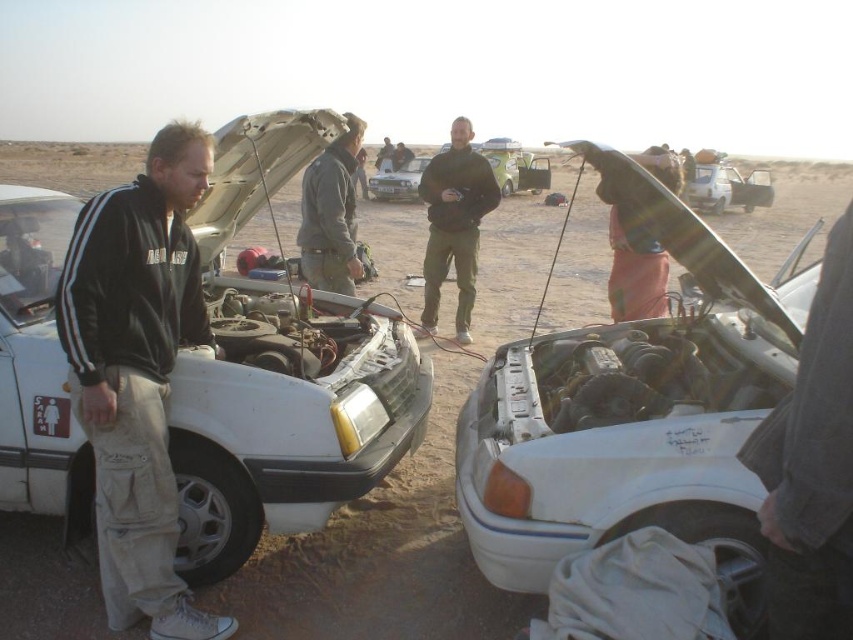
Image resolution: width=853 pixels, height=640 pixels. What do you see at coordinates (635, 412) in the screenshot?
I see `white matte car at center` at bounding box center [635, 412].

Locate an element on the screen. Image resolution: width=853 pixels, height=640 pixels. white matte car at center is located at coordinates (635, 412).

Is black matte jacket at center positioned in front of metallic silver car at center?

Yes, black matte jacket at center is in front of metallic silver car at center.

Between black matte jacket at center and metallic silver car at center, which one has less height?

Standing shorter between the two is metallic silver car at center.

Does point (433, 298) come behind point (718, 173)?

No, (433, 298) is in front of (718, 173).

You are a GUI agent. You are given a task and a screenshot of the screen. Output one action in this format:
    pyautogui.click(x=<x>, y=<y>)
    Task: Click on the black matte jacket at center
    Image resolution: width=853 pixels, height=640 pixels.
    Given the screenshot: What is the action you would take?
    pyautogui.click(x=454, y=224)

Can you confirm if black cotton jacket at left is taller than matte silver sedan at center?

Yes.

Identify the location of black cotton jacket at left. click(x=138, y=372).

Is point (113, 371) closer to camera compared to point (407, 186)?

Yes.

Where is `black cotton jacket at left`? The width and height of the screenshot is (853, 640). black cotton jacket at left is located at coordinates (138, 372).